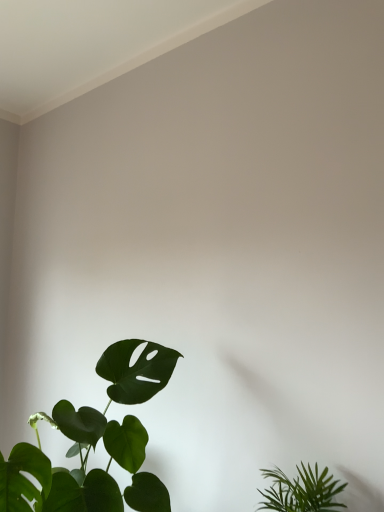
Image resolution: width=384 pixels, height=512 pixels. Describe the element at coordinates (95, 443) in the screenshot. I see `green matte leaf at lower left` at that location.

Measure the distance between green matte leaf at lower left and camera.

A distance of 74.05 centimeters exists between green matte leaf at lower left and camera.

Locate an element on the screen. This screenshot has width=384, height=512. green matte leaf at lower left is located at coordinates (95, 443).

I want to click on green matte leaf at lower left, so click(x=95, y=443).